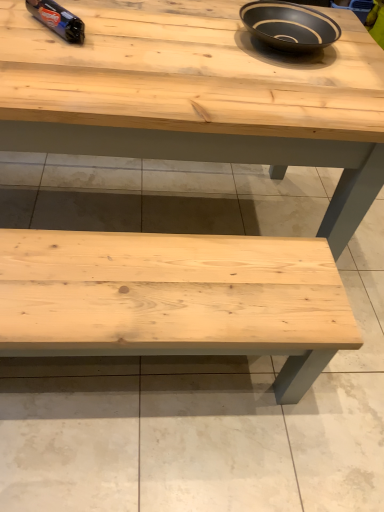
Identify the location of free area behind shiny blue plastic bottle at upper left. The width and height of the screenshot is (384, 512). (97, 10).